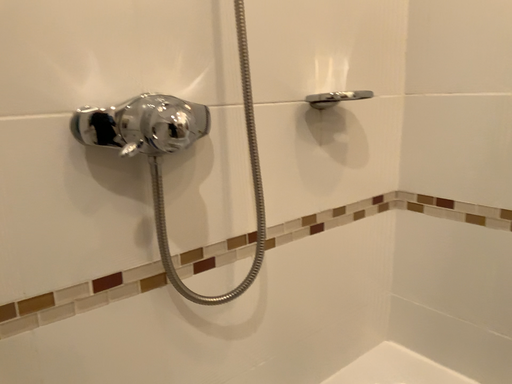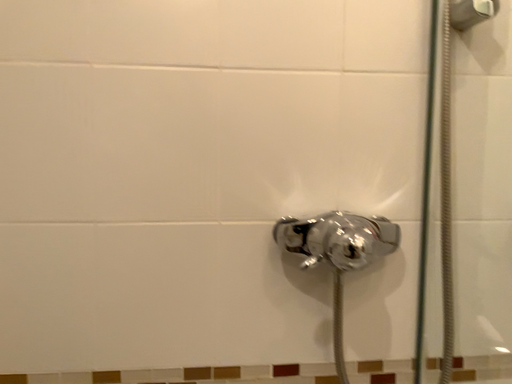
Question: Which way did the camera rotate in the video?

Choices:
 (A) rotated downward
 (B) rotated upward

Answer: (B)